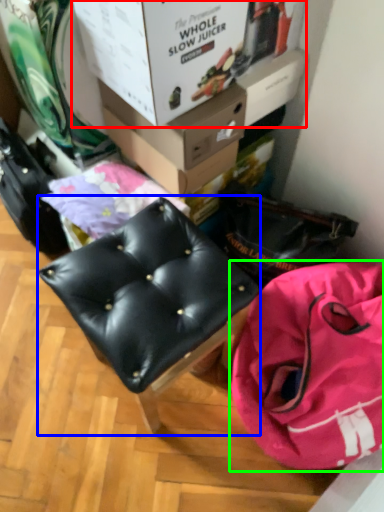
Question: Which object is positioned closest to box (highlighted by a red box)? Select from furniture (highlighted by a blue box) and handbag (highlighted by a green box).

Choices:
 (A) furniture
 (B) handbag

Answer: (A)